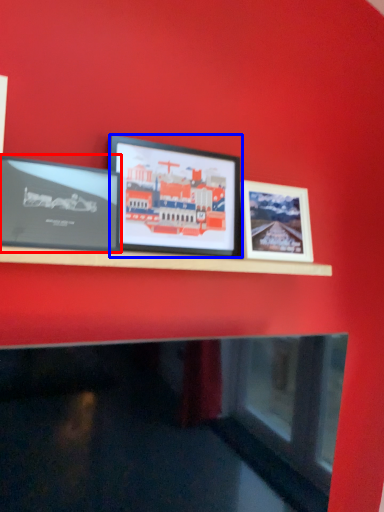
Question: Which of the following is the closest to the observer, picture frame (highlighted by a red box) or picture frame (highlighted by a blue box)?

Choices:
 (A) picture frame
 (B) picture frame

Answer: (A)